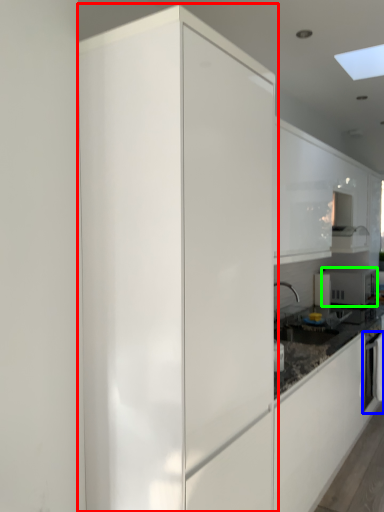
Question: Which object is the closest to the cabinetry (highlighted by a red box)? Choose among these: oven (highlighted by a blue box) or home appliance (highlighted by a green box).

Choices:
 (A) oven
 (B) home appliance

Answer: (A)